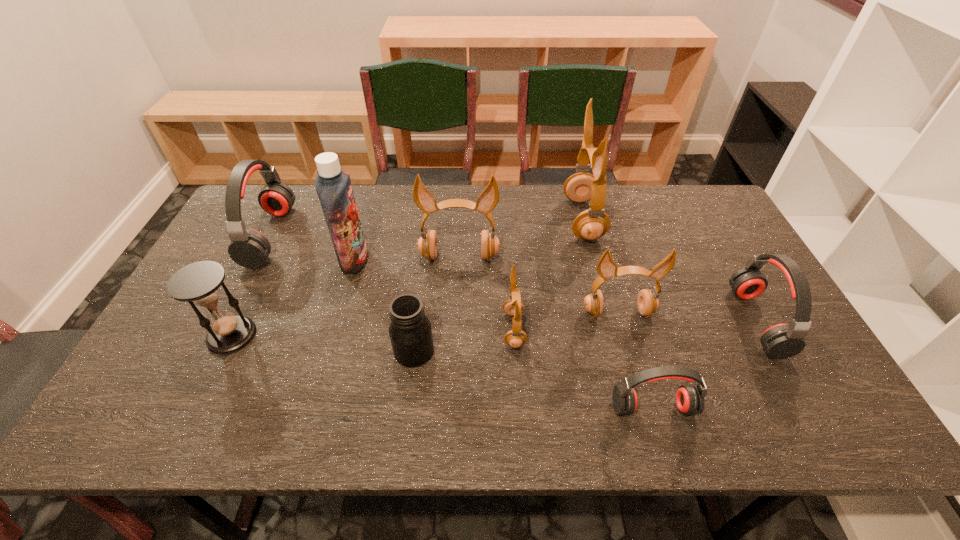
Where is `the biggest brown earphone`? the biggest brown earphone is located at coordinates (591, 224).

At what (x,y) coordinates should I click in order to perform the action: click on the eighth object from right to left. Please return your answer as a coordinate pair (x, y). The width and height of the screenshot is (960, 540). Looking at the image, I should click on (333, 186).

The height and width of the screenshot is (540, 960). In order to click on blue shampoo in this screenshot , I will do `click(333, 186)`.

I want to click on the third tallest object, so click(x=487, y=200).

Find the location of `the third smallest brown earphone`. the third smallest brown earphone is located at coordinates (487, 200).

Where is `the leftmost red earphone`? This screenshot has height=540, width=960. the leftmost red earphone is located at coordinates (249, 248).

The width and height of the screenshot is (960, 540). What are the coordinates of `the biggest red earphone` in the screenshot? It's located at (x=249, y=248).

Locate an element on the screen. The width and height of the screenshot is (960, 540). the second smallest brown earphone is located at coordinates (648, 303).

Identify the location of hourglass. (198, 283).

Find the location of a particular element. The image size is (960, 540). the rightmost earphone is located at coordinates (781, 341).